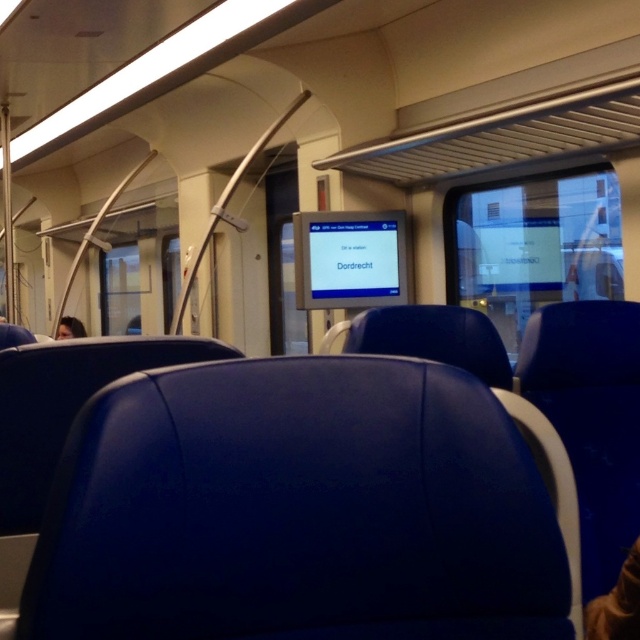
Is matte blue seat at center to the right of smooth skin face at left from the viewer's perspective?

Correct, you'll find matte blue seat at center to the right of smooth skin face at left.

This screenshot has width=640, height=640. I want to click on matte blue seat at center, so (x=305, y=508).